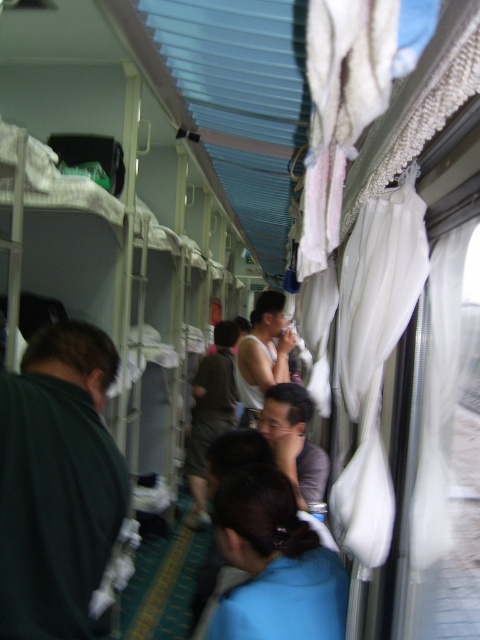
Question: Which point appears closest to the camera in this image?

Choices:
 (A) (274, 486)
 (B) (54, 512)
 (C) (210, 442)

Answer: (B)

Question: Can you confirm if blue fabric at center is positioned to the left of white matte tank top at center?

Choices:
 (A) no
 (B) yes

Answer: (A)

Question: Which object is the closest to the dark green fabric at left?

Choices:
 (A) blue fabric at center
 (B) dark green fabric at center
 (C) white matte tank top at center

Answer: (A)

Question: Where is dark green fabric at left located in relation to blue fabric at center in the image?

Choices:
 (A) above
 (B) below

Answer: (A)

Question: Which object is farther from the camera taking this photo?

Choices:
 (A) dark green fabric at center
 (B) white matte tank top at center
 (C) blue fabric at center

Answer: (A)

Question: Can you confirm if dark green fabric at left is wider than blue fabric at center?

Choices:
 (A) no
 (B) yes

Answer: (A)